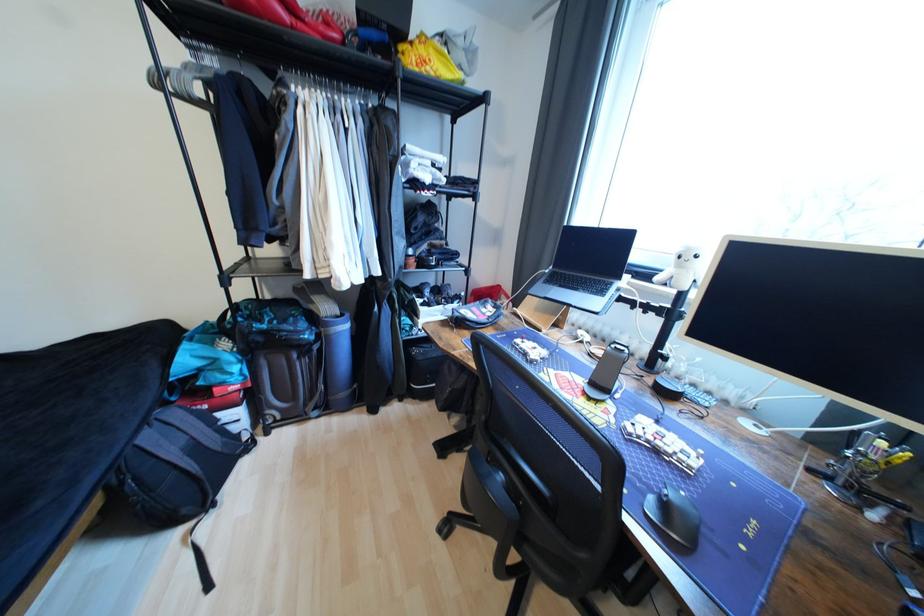
This screenshot has width=924, height=616. Find the location of `white split keyboard`. white split keyboard is located at coordinates (662, 440).